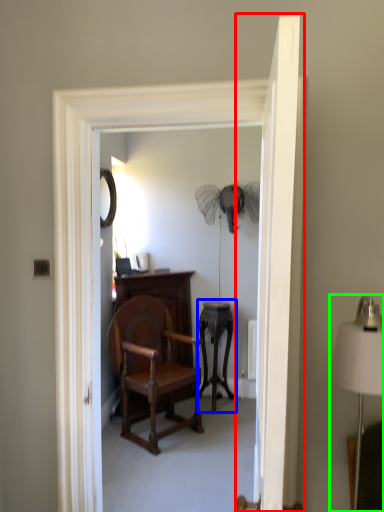
Question: Based on their relative distances, which object is farther from door (highlighted by a red box)? Choose from side table (highlighted by a blue box) and table lamp (highlighted by a green box).

Choices:
 (A) side table
 (B) table lamp

Answer: (A)